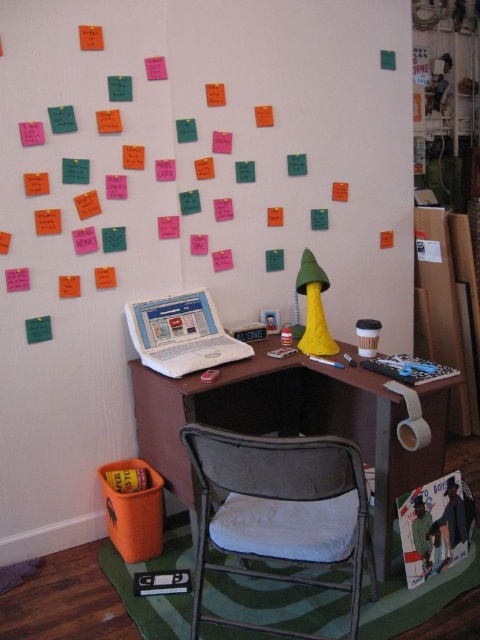
Question: Is brown wood computer desk at center to the left of white plastic laptop at center from the viewer's perspective?

Choices:
 (A) yes
 (B) no

Answer: (B)

Question: Can you confirm if brown wood computer desk at center is bigger than white plastic laptop at center?

Choices:
 (A) yes
 (B) no

Answer: (A)

Question: Estimate the real-world distances between objects in this image. Which object is closer to the metallic gray folding chair at center?

Choices:
 (A) brown wood computer desk at center
 (B) white plastic laptop at center

Answer: (A)

Question: Which point is closer to the camera?

Choices:
 (A) (212, 314)
 (B) (315, 435)
 (C) (199, 580)

Answer: (C)

Question: Which object is positioned farthest from the metallic gray folding chair at center?

Choices:
 (A) white plastic laptop at center
 (B) brown wood computer desk at center

Answer: (A)

Question: Does brown wood computer desk at center appear under white plastic laptop at center?

Choices:
 (A) no
 (B) yes

Answer: (B)